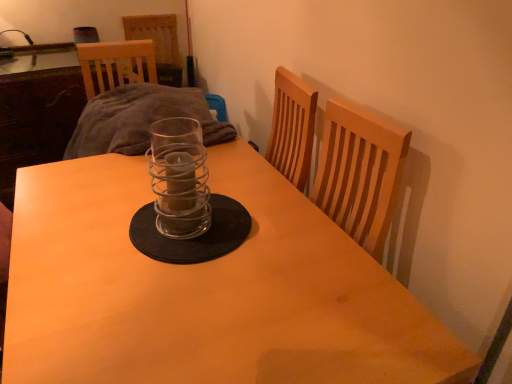
You are a GUI agent. You are given a task and a screenshot of the screen. Output one action in this format:
    pyautogui.click(x=<x>, y=<y>)
    Task: Click on the free space to the left of clear glass candle holder at center
    The image size is (512, 384).
    Given the screenshot: What is the action you would take?
    pyautogui.click(x=103, y=230)